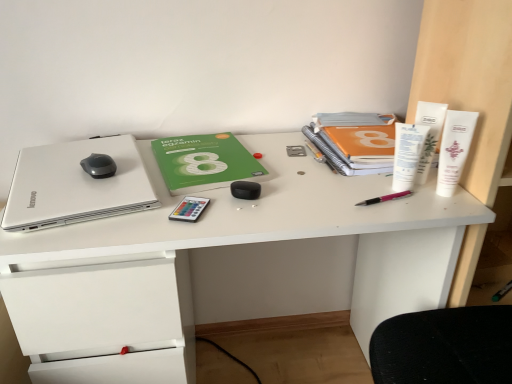
You are a GUI agent. You are given a task and a screenshot of the screen. Output one action in this format:
    pyautogui.click(x=<x>, y=<y>)
    Task: Click on the vacant area that lies between orange matte notebook at upper right, which is the 2th paperback book in left-to-right order, and pink metallic pen at center-right, which ranks as the 4th stationery in right-to-left order
    
    Given the screenshot: What is the action you would take?
    (372, 182)